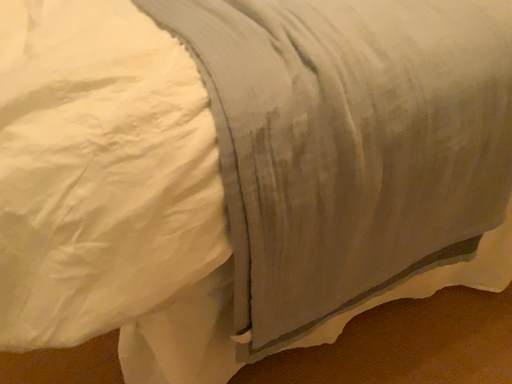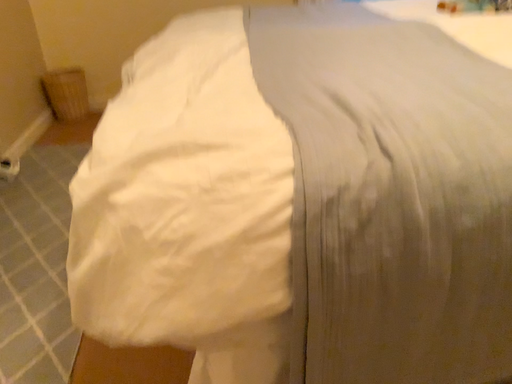
Question: Which way did the camera rotate in the video?

Choices:
 (A) rotated downward
 (B) rotated upward

Answer: (B)